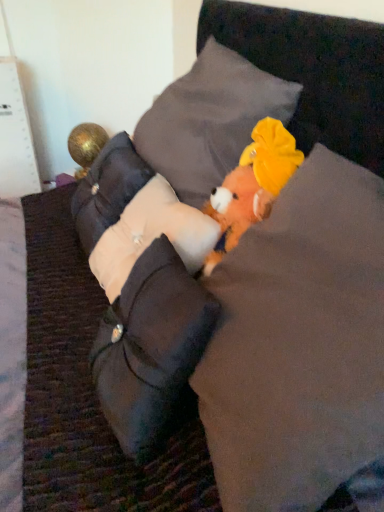
Describe the element at coordinates (210, 120) in the screenshot. I see `velvet gray pillow at center, positioned as the first pillow in top-to-bottom order` at that location.

Locate an element on the screen. white fabric pillow at center, which ranks as the fourth pillow in top-to-bottom order is located at coordinates (152, 350).

Where is `fluffy orange plush toy at center`? fluffy orange plush toy at center is located at coordinates (163, 271).

The image size is (384, 512). What do you see at coordinates (163, 271) in the screenshot? I see `fluffy orange plush toy at center` at bounding box center [163, 271].

The height and width of the screenshot is (512, 384). I want to click on fluffy orange plush toy at center, the second toy when ordered from back to front, so click(252, 185).

Does beige fabric pillow at left, the 2th pillow positioned from the top, turn towards fluffy orange plush toy at center, which is counted as the 1th toy, starting from the front?

No, beige fabric pillow at left, the 2th pillow positioned from the top, does not turn towards fluffy orange plush toy at center, which is counted as the 1th toy, starting from the front.

From a real-world perspective, is beige fabric pillow at left, the 3th pillow in the bottom-to-top sequence, under fluffy orange plush toy at center, arranged as the first toy when viewed from the right?

Correct, in the physical world, beige fabric pillow at left, the 3th pillow in the bottom-to-top sequence, is lower than fluffy orange plush toy at center, arranged as the first toy when viewed from the right.

You are a GUI agent. You are given a task and a screenshot of the screen. Output one action in this format:
    pyautogui.click(x=<x>, y=<y>)
    Task: Click on the 4th pillow counting from the left side of the fluffy orange plush toy at center, placed as the 1th toy when sorted from bottom to top
    
    Given the screenshot: What is the action you would take?
    tap(108, 189)

Is white fabric pillow at center, the 1th pillow ordered from the bottom, facing away from gold metallic ball at left, positioned as the second toy in front-to-back order?

No, white fabric pillow at center, the 1th pillow ordered from the bottom, is not facing away from gold metallic ball at left, positioned as the second toy in front-to-back order.

Is white fabric pillow at center, the 1th pillow ordered from the bottom, inside the boundaries of gold metallic ball at left, which is counted as the first toy, starting from the left, or outside?

white fabric pillow at center, the 1th pillow ordered from the bottom, exists outside the volume of gold metallic ball at left, which is counted as the first toy, starting from the left.

Starting from the fluffy orange plush toy at center, which pillow is the 1st one to the left? Please provide its 2D coordinates.

[(210, 120)]

Does velvet gray pillow at center, positioned as the first pillow in top-to-bottom order, appear on the left side of fluffy orange plush toy at center?

Indeed, velvet gray pillow at center, positioned as the first pillow in top-to-bottom order, is positioned on the left side of fluffy orange plush toy at center.

From the image's perspective, which is above, velvet gray pillow at center, which ranks as the 4th pillow in bottom-to-top order, or fluffy orange plush toy at center?

velvet gray pillow at center, which ranks as the 4th pillow in bottom-to-top order, from the image's perspective.

How many degrees apart are the facing directions of velvet gray pillow at center, positioned as the first pillow in top-to-bottom order, and fluffy orange plush toy at center?

The angle between the facing direction of velvet gray pillow at center, positioned as the first pillow in top-to-bottom order, and the facing direction of fluffy orange plush toy at center is 0.0246 degrees.

The height and width of the screenshot is (512, 384). I want to click on pillow that appears on the left of white fabric pillow at center, which is the third pillow in top-to-bottom order, so click(x=108, y=189).

Between point (130, 177) and point (192, 207), which one is positioned behind?

The point (130, 177) is more distant.

In terms of size, does beige fabric pillow at left, the 3th pillow in the bottom-to-top sequence, appear bigger or smaller than white fabric pillow at center, which is the third pillow in top-to-bottom order?

Clearly, beige fabric pillow at left, the 3th pillow in the bottom-to-top sequence, is larger in size than white fabric pillow at center, which is the third pillow in top-to-bottom order.

Consider the image. Is fluffy orange plush toy at center situated inside fluffy orange plush toy at center, which is counted as the 1th toy, starting from the front, or outside?

fluffy orange plush toy at center is located beyond the bounds of fluffy orange plush toy at center, which is counted as the 1th toy, starting from the front.

How many degrees apart are the facing directions of fluffy orange plush toy at center and fluffy orange plush toy at center, arranged as the first toy when viewed from the right?

The facing directions of fluffy orange plush toy at center and fluffy orange plush toy at center, arranged as the first toy when viewed from the right, are 4.19 degrees apart.

Identify the location of toy positioned vertically above the fluffy orange plush toy at center (from a real-world perspective). The width and height of the screenshot is (384, 512). (252, 185).

Between fluffy orange plush toy at center and fluffy orange plush toy at center, which is counted as the 1th toy, starting from the front, which one has smaller width?

With smaller width is fluffy orange plush toy at center, which is counted as the 1th toy, starting from the front.

From their relative heights in the image, would you say white fabric pillow at center, which is the third pillow in top-to-bottom order, is taller or shorter than white fabric pillow at center, which ranks as the fourth pillow in top-to-bottom order?

In the image, white fabric pillow at center, which is the third pillow in top-to-bottom order, appears to be shorter than white fabric pillow at center, which ranks as the fourth pillow in top-to-bottom order.

Which is behind, white fabric pillow at center, which is the third pillow in top-to-bottom order, or white fabric pillow at center, the 1th pillow ordered from the bottom?

white fabric pillow at center, which is the third pillow in top-to-bottom order, is behind.

Is point (169, 233) less distant than point (174, 334)?

No, it is behind (174, 334).

Looking at this image, is white fabric pillow at center, which is the third pillow in top-to-bottom order, to the right of white fabric pillow at center, the 1th pillow ordered from the bottom, from the viewer's perspective?

In fact, white fabric pillow at center, which is the third pillow in top-to-bottom order, is to the left of white fabric pillow at center, the 1th pillow ordered from the bottom.

In terms of width, does gold metallic ball at left, which is counted as the first toy, starting from the left, look wider or thinner when compared to white fabric pillow at center, the 1th pillow ordered from the bottom?

Clearly, gold metallic ball at left, which is counted as the first toy, starting from the left, has less width compared to white fabric pillow at center, the 1th pillow ordered from the bottom.

Considering the relative sizes of gold metallic ball at left, which is counted as the first toy, starting from the left, and white fabric pillow at center, the 1th pillow ordered from the bottom, in the image provided, is gold metallic ball at left, which is counted as the first toy, starting from the left, smaller than white fabric pillow at center, the 1th pillow ordered from the bottom,?

Yes.

From a real-world perspective, is gold metallic ball at left, the first toy in the top-to-bottom sequence, over white fabric pillow at center, which ranks as the fourth pillow in top-to-bottom order?

No, from a real-world perspective, gold metallic ball at left, the first toy in the top-to-bottom sequence, is not above white fabric pillow at center, which ranks as the fourth pillow in top-to-bottom order.

Consider the image. From the image's perspective, which object appears higher, gold metallic ball at left, which is counted as the first toy, starting from the left, or white fabric pillow at center, the 1th pillow ordered from the bottom?

gold metallic ball at left, which is counted as the first toy, starting from the left.

What are the coordinates of `toy above the beige fabric pillow at left, the 2th pillow positioned from the top (from a real-world perspective)` in the screenshot? It's located at (252, 185).

There is a white fabric pillow at center, the 1th pillow ordered from the bottom. At what (x,y) coordinates should I click in order to perform the action: click on the 2nd toy above it (from the image's perspective). Please return your answer as a coordinate pair (x, y). This screenshot has height=512, width=384. Looking at the image, I should click on (86, 145).

Estimate the real-world distances between objects in this image. Which object is closer to white fabric pillow at center, the 2th pillow when ordered from bottom to top, white fabric pillow at center, which ranks as the fourth pillow in top-to-bottom order, or fluffy orange plush toy at center?

fluffy orange plush toy at center lies closer to white fabric pillow at center, the 2th pillow when ordered from bottom to top, than the other object.

In the scene shown: From the image, which object appears to be farther from fluffy orange plush toy at center, which is counted as the 1th toy, starting from the front, white fabric pillow at center, which is the third pillow in top-to-bottom order, or velvet gray pillow at center, which ranks as the 4th pillow in bottom-to-top order?

The object further to fluffy orange plush toy at center, which is counted as the 1th toy, starting from the front, is velvet gray pillow at center, which ranks as the 4th pillow in bottom-to-top order.

When comparing their distances from beige fabric pillow at left, the 2th pillow positioned from the top, does velvet gray pillow at center, which ranks as the 4th pillow in bottom-to-top order, or fluffy orange plush toy at center seem further?

Among the two, velvet gray pillow at center, which ranks as the 4th pillow in bottom-to-top order, is located further to beige fabric pillow at left, the 2th pillow positioned from the top.

Based on their spatial positions, is velvet gray pillow at center, which ranks as the 4th pillow in bottom-to-top order, or white fabric pillow at center, the 2th pillow when ordered from bottom to top, closer to fluffy orange plush toy at center, the second toy when ordered from back to front?

white fabric pillow at center, the 2th pillow when ordered from bottom to top.

Considering their positions, is fluffy orange plush toy at center, placed as the 1th toy when sorted from bottom to top, positioned further to beige fabric pillow at left, the 2th pillow positioned from the top, than white fabric pillow at center, the 2th pillow when ordered from bottom to top?

Among the two, fluffy orange plush toy at center, placed as the 1th toy when sorted from bottom to top, is located further to beige fabric pillow at left, the 2th pillow positioned from the top.

Looking at the image, which one is located closer to white fabric pillow at center, the 2th pillow when ordered from bottom to top, velvet gray pillow at center, positioned as the first pillow in top-to-bottom order, or fluffy orange plush toy at center?

Based on the image, fluffy orange plush toy at center appears to be nearer to white fabric pillow at center, the 2th pillow when ordered from bottom to top.

Consider the image. Based on their spatial positions, is velvet gray pillow at center, which ranks as the 4th pillow in bottom-to-top order, or white fabric pillow at center, the 1th pillow ordered from the bottom, further from beige fabric pillow at left, the 2th pillow positioned from the top?

white fabric pillow at center, the 1th pillow ordered from the bottom.

Based on the photo, from the image, which object appears to be farther from fluffy orange plush toy at center, which appears as the second toy when viewed from the left, white fabric pillow at center, the 1th pillow ordered from the bottom, or gold metallic ball at left, which is counted as the first toy, starting from the left?

The object further to fluffy orange plush toy at center, which appears as the second toy when viewed from the left, is gold metallic ball at left, which is counted as the first toy, starting from the left.

Locate an element on the screen. toy between velvet gray pillow at center, which ranks as the 4th pillow in bottom-to-top order, and white fabric pillow at center, the 2th pillow when ordered from bottom to top, from top to bottom is located at coordinates (252, 185).

At what (x,y) coordinates should I click in order to perform the action: click on toy positioned between fluffy orange plush toy at center and white fabric pillow at center, which is the third pillow in top-to-bottom order, from near to far. Please return your answer as a coordinate pair (x, y). Looking at the image, I should click on (252, 185).

Find the location of `pillow positioned between white fabric pillow at center, the 2th pillow when ordered from bottom to top, and gold metallic ball at left, positioned as the second toy in front-to-back order, from near to far`. pillow positioned between white fabric pillow at center, the 2th pillow when ordered from bottom to top, and gold metallic ball at left, positioned as the second toy in front-to-back order, from near to far is located at coordinates (108, 189).

What are the coordinates of `pillow that lies between fluffy orange plush toy at center, placed as the 1th toy when sorted from bottom to top, and white fabric pillow at center, the 1th pillow ordered from the bottom, from top to bottom` in the screenshot? It's located at (151, 234).